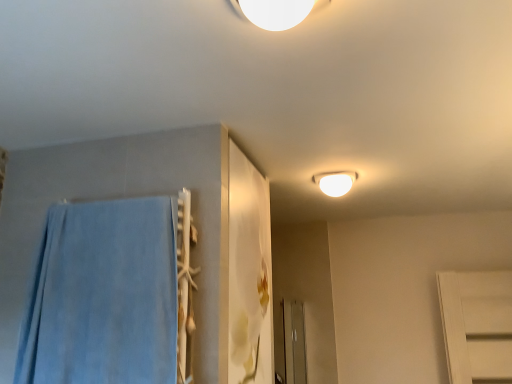
Question: Can you confirm if white glossy light fixture at upper center is positioned to the right of blue soft towel at left?

Choices:
 (A) yes
 (B) no

Answer: (A)

Question: Considering the relative sizes of white glossy light fixture at upper center and blue soft towel at left in the image provided, is white glossy light fixture at upper center wider than blue soft towel at left?

Choices:
 (A) yes
 (B) no

Answer: (A)

Question: Is white glossy light fixture at upper center beside blue soft towel at left?

Choices:
 (A) no
 (B) yes

Answer: (A)

Question: From a real-world perspective, is white glossy light fixture at upper center under blue soft towel at left?

Choices:
 (A) yes
 (B) no

Answer: (B)

Question: Is the depth of white glossy light fixture at upper center greater than that of blue soft towel at left?

Choices:
 (A) no
 (B) yes

Answer: (B)

Question: From a real-world perspective, is white glossy light fixture at upper center on top of blue soft towel at left?

Choices:
 (A) yes
 (B) no

Answer: (A)

Question: Is blue soft towel at left with white glossy light fixture at upper center?

Choices:
 (A) yes
 (B) no

Answer: (B)

Question: From a real-world perspective, is blue soft towel at left located higher than white glossy light fixture at upper center?

Choices:
 (A) no
 (B) yes

Answer: (A)

Question: Is white glossy light fixture at upper center at the back of blue soft towel at left?

Choices:
 (A) no
 (B) yes

Answer: (A)

Question: Considering the relative sizes of blue soft towel at left and white glossy light fixture at upper center in the image provided, is blue soft towel at left thinner than white glossy light fixture at upper center?

Choices:
 (A) yes
 (B) no

Answer: (A)

Question: Can you confirm if blue soft towel at left is smaller than white glossy light fixture at upper center?

Choices:
 (A) no
 (B) yes

Answer: (A)

Question: Considering the relative sizes of blue soft towel at left and white glossy light fixture at upper center in the image provided, is blue soft towel at left taller than white glossy light fixture at upper center?

Choices:
 (A) yes
 (B) no

Answer: (A)

Question: Would you say white glossy light fixture at upper center is inside or outside blue soft towel at left?

Choices:
 (A) outside
 (B) inside

Answer: (A)